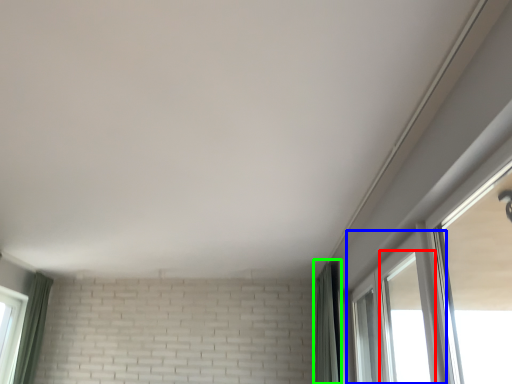
Question: Estimate the real-world distances between objects in this image. Which object is closer to window (highlighted by a red box), window (highlighted by a blue box) or curtain (highlighted by a green box)?

Choices:
 (A) window
 (B) curtain

Answer: (B)